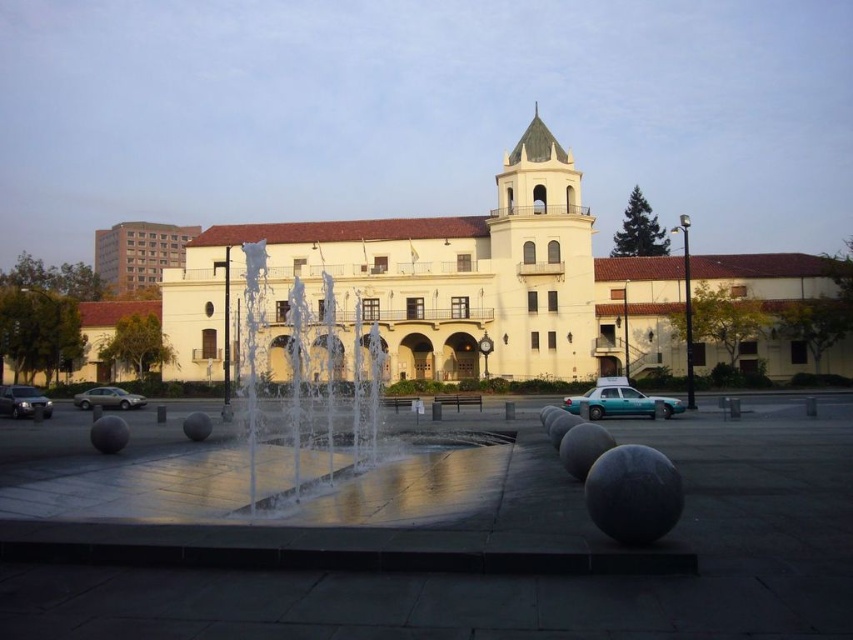
Question: Which point is closer to the camera?

Choices:
 (A) (113, 390)
 (B) (466, 612)

Answer: (B)

Question: Which object is farther from the camera taking this photo?

Choices:
 (A) silver metallic sedan at lower left
 (B) matte silver suv at lower left
 (C) teal glossy taxi at center
 (D) clear glass water at center

Answer: (A)

Question: Can you confirm if white stucco building at center is positioned to the left of clear glass water at center?

Choices:
 (A) yes
 (B) no

Answer: (B)

Question: Is clear glass water at center to the right of teal glossy taxi at center from the viewer's perspective?

Choices:
 (A) no
 (B) yes

Answer: (A)

Question: Can you confirm if white stucco building at center is thinner than teal glossy taxi at center?

Choices:
 (A) yes
 (B) no

Answer: (B)

Question: Estimate the real-world distances between objects in this image. Which object is farther from the silver metallic sedan at lower left?

Choices:
 (A) polished granite fountain at center
 (B) teal glossy taxi at center
 (C) clear glass water at center

Answer: (A)